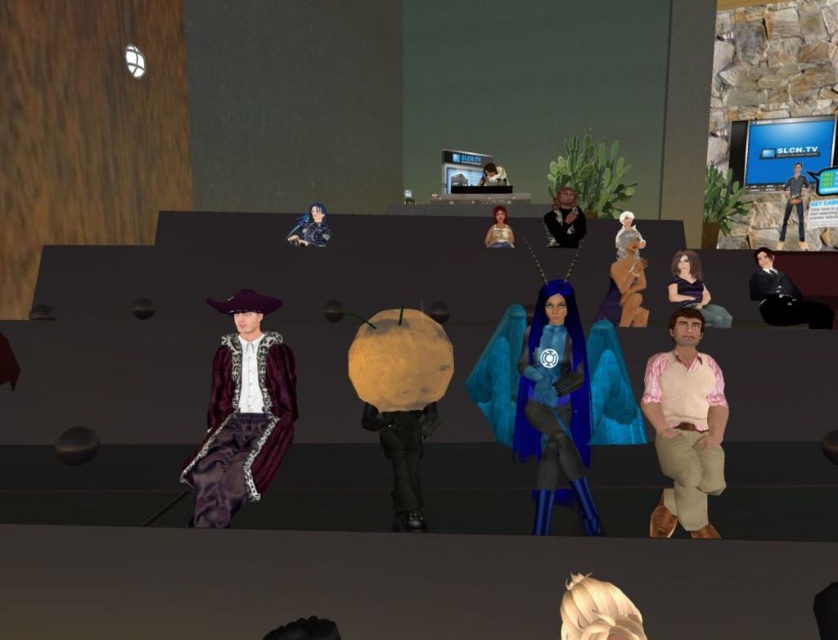
You are an avatar standing on the stage and want to move to the blue glossy tv at upper right to interact with it. Is the velvet maroon coat at left blocking your path?

The velvet maroon coat at left is to the left of the blue glossy tv at upper right, so it is not blocking the path to the tv. You can move towards the blue glossy tv at upper right without any obstruction from the velvet maroon coat at left.

You are an avatar attending a virtual event and want to take a photo with the matte gold dress at center and the matte black jacket at upper center. Which object is positioned lower in the frame?

The matte gold dress at center is positioned below the matte black jacket at upper center, so it is lower in the frame.

In the scene shown: You are organizing a fashion show and need to arrange the matte gold dress at center and the matte black jacket at upper center on a runway. Which one should be placed first if you want to start with the narrower item?

The matte gold dress at center should be placed first because its width is less than the matte black jacket at upper center.